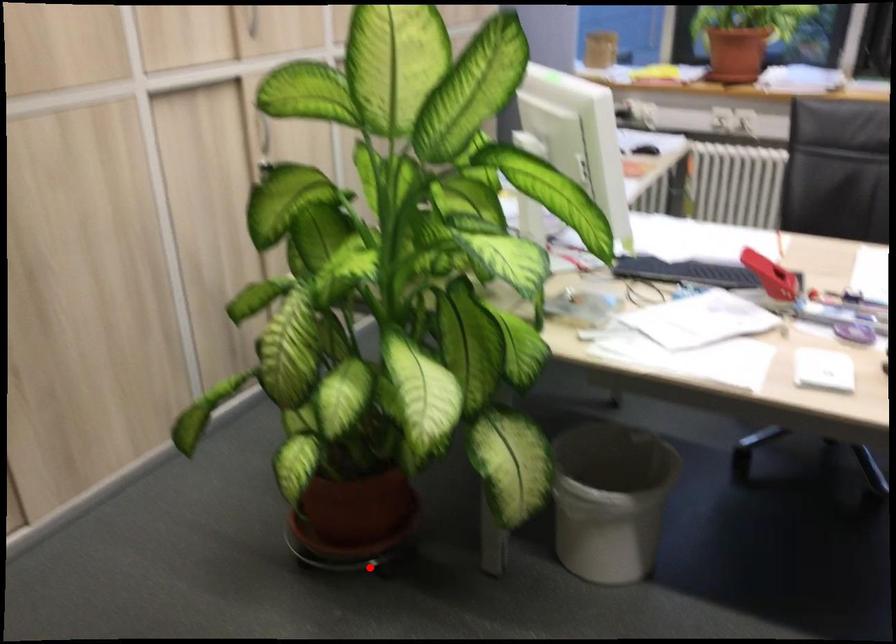
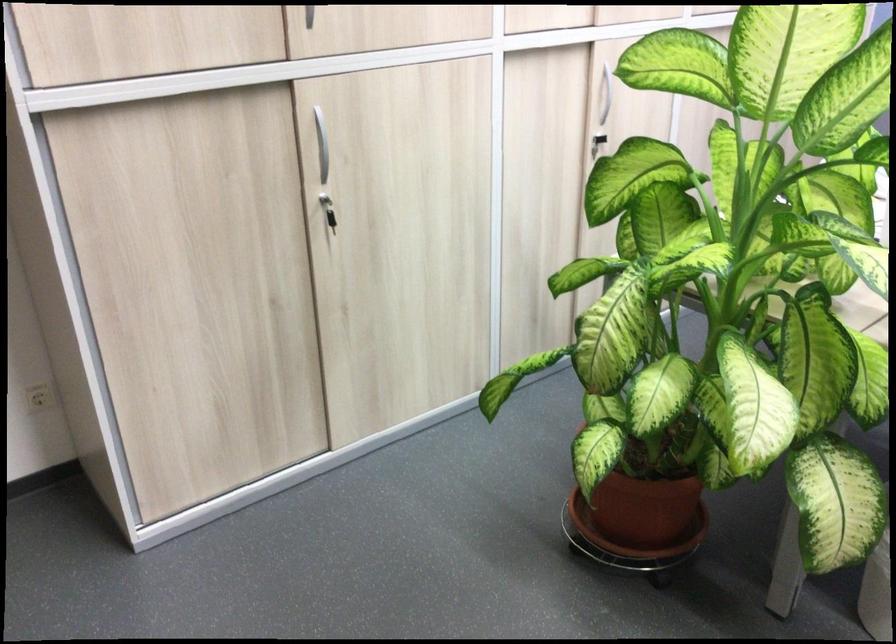
The point at the highlighted location is marked in the first image. Where is the corresponding point in the second image?

(636, 564)